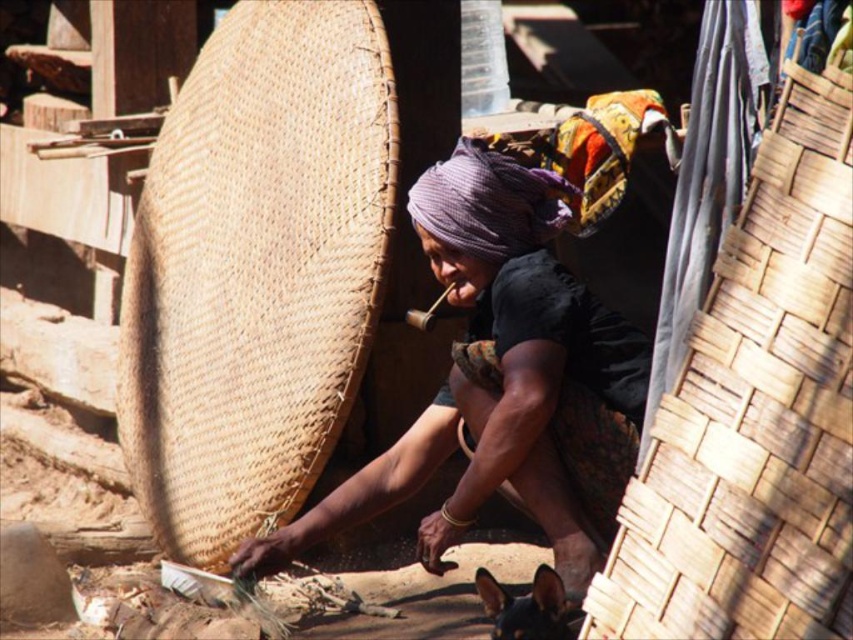
Question: Is matte woven basket at center thinner than black glossy dog at lower right?

Choices:
 (A) yes
 (B) no

Answer: (B)

Question: Which object appears closest to the camera in this image?

Choices:
 (A) matte woven basket at center
 (B) black glossy dog at lower right

Answer: (B)

Question: Is matte woven basket at center bigger than black glossy dog at lower right?

Choices:
 (A) no
 (B) yes

Answer: (B)

Question: Does matte woven basket at center have a greater width compared to black glossy dog at lower right?

Choices:
 (A) no
 (B) yes

Answer: (B)